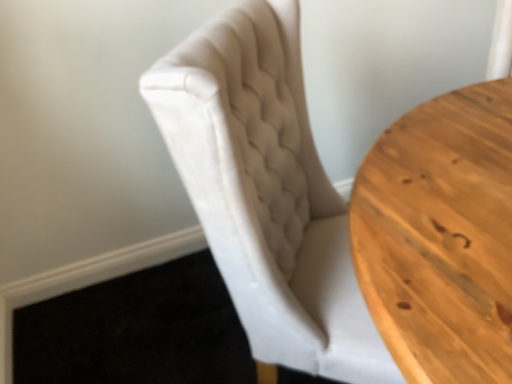
The height and width of the screenshot is (384, 512). What do you see at coordinates (266, 192) in the screenshot?
I see `beige fabric chair at center` at bounding box center [266, 192].

Find the location of a particular element. beige fabric chair at center is located at coordinates (266, 192).

What are the coordinates of `beige fabric chair at center` in the screenshot? It's located at (266, 192).